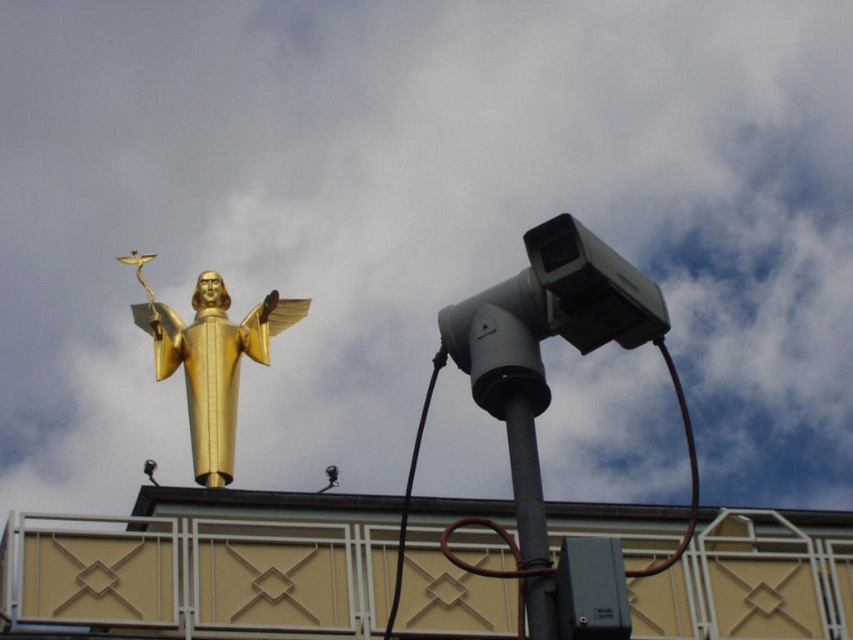
Can you confirm if gold polished statue at upper left is shorter than black metallic pole at center?

In fact, gold polished statue at upper left may be taller than black metallic pole at center.

Is gold polished statue at upper left bigger than black metallic pole at center?

Yes.

In the scene shown: Who is more forward, (172, 340) or (531, 420)?

Positioned in front is point (531, 420).

At what (x,y) coordinates should I click in order to perform the action: click on gold polished statue at upper left. Please return your answer as a coordinate pair (x, y). Image resolution: width=853 pixels, height=640 pixels. Looking at the image, I should click on (210, 358).